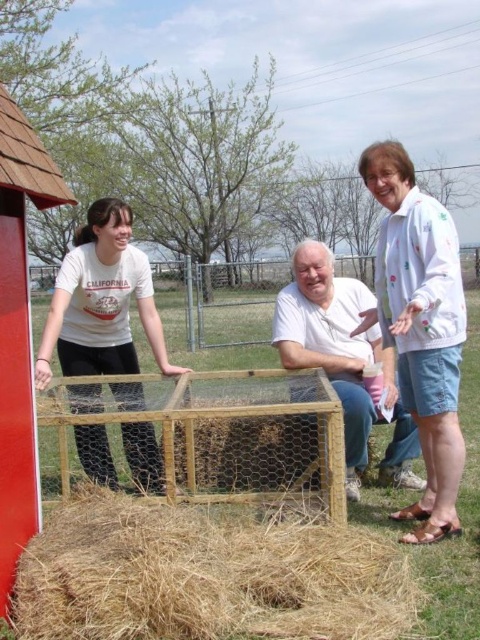
Can you confirm if matte white shirt at center is positioned to the right of white matte chicken wire at center?

In fact, matte white shirt at center is to the left of white matte chicken wire at center.

Can you confirm if matte white shirt at center is positioned below white matte chicken wire at center?

Incorrect, matte white shirt at center is not positioned below white matte chicken wire at center.

Where is `matte white shirt at center`? The width and height of the screenshot is (480, 640). matte white shirt at center is located at coordinates (100, 301).

Does brown straw at lower center appear on the left side of matte white shirt at center?

Incorrect, brown straw at lower center is not on the left side of matte white shirt at center.

Who is taller, brown straw at lower center or matte white shirt at center?

Standing taller between the two is matte white shirt at center.

I want to click on brown straw at lower center, so click(204, 577).

This screenshot has width=480, height=640. Identify the location of brown straw at lower center. (204, 577).

Does brown straw at lower center appear on the right side of white dotted jacket at upper right?

No, brown straw at lower center is not to the right of white dotted jacket at upper right.

Can you confirm if brown straw at lower center is thinner than white dotted jacket at upper right?

No.

Between point (101, 611) and point (411, 333), which one is positioned in front?

Point (101, 611) is in front.

Image resolution: width=480 pixels, height=640 pixels. I want to click on brown straw at lower center, so click(204, 577).